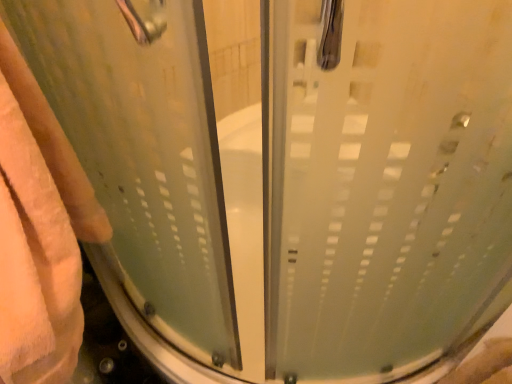
Question: In which direction should I rotate to look at frosted glass shower door at center, the 1th screen door in the left-to-right sequence?

Choices:
 (A) left
 (B) right

Answer: (A)

Question: In which direction should I rotate to look at frosted glass shower door at center, the 2th screen door when ordered from left to right?

Choices:
 (A) right
 (B) left

Answer: (A)

Question: Can you confirm if beige fluffy towel at left is wider than frosted glass shower door at center, the 2th screen door when ordered from left to right?

Choices:
 (A) no
 (B) yes

Answer: (B)

Question: From the image's perspective, is beige fluffy towel at left on frosted glass shower door at center, the 2th screen door when ordered from left to right?

Choices:
 (A) yes
 (B) no

Answer: (B)

Question: Does beige fluffy towel at left turn towards frosted glass shower door at center, the 2th screen door when ordered from left to right?

Choices:
 (A) no
 (B) yes

Answer: (A)

Question: Is beige fluffy towel at left positioned beyond the bounds of frosted glass shower door at center, placed as the 1th screen door when sorted from right to left?

Choices:
 (A) no
 (B) yes

Answer: (B)

Question: Is beige fluffy towel at left smaller than frosted glass shower door at center, the 2th screen door when ordered from left to right?

Choices:
 (A) no
 (B) yes

Answer: (A)

Question: Considering the relative sizes of beige fluffy towel at left and frosted glass shower door at center, placed as the 1th screen door when sorted from right to left, in the image provided, is beige fluffy towel at left taller than frosted glass shower door at center, placed as the 1th screen door when sorted from right to left,?

Choices:
 (A) no
 (B) yes

Answer: (B)

Question: Can we say beige fluffy towel at left lies outside frosted glass shower door at center, placed as the 2th screen door when sorted from right to left?

Choices:
 (A) no
 (B) yes

Answer: (B)

Question: Could you tell me if beige fluffy towel at left is turned towards frosted glass shower door at center, placed as the 2th screen door when sorted from right to left?

Choices:
 (A) yes
 (B) no

Answer: (B)

Question: Can you confirm if beige fluffy towel at left is smaller than frosted glass shower door at center, the 1th screen door in the left-to-right sequence?

Choices:
 (A) no
 (B) yes

Answer: (A)

Question: Is beige fluffy towel at left taller than frosted glass shower door at center, placed as the 2th screen door when sorted from right to left?

Choices:
 (A) no
 (B) yes

Answer: (B)

Question: Is beige fluffy towel at left shorter than frosted glass shower door at center, the 1th screen door in the left-to-right sequence?

Choices:
 (A) no
 (B) yes

Answer: (A)

Question: Is there a large distance between beige fluffy towel at left and frosted glass shower door at center, placed as the 2th screen door when sorted from right to left?

Choices:
 (A) no
 (B) yes

Answer: (A)

Question: Is frosted glass shower door at center, placed as the 2th screen door when sorted from right to left, wider than frosted glass shower door at center, the 2th screen door when ordered from left to right?

Choices:
 (A) yes
 (B) no

Answer: (B)